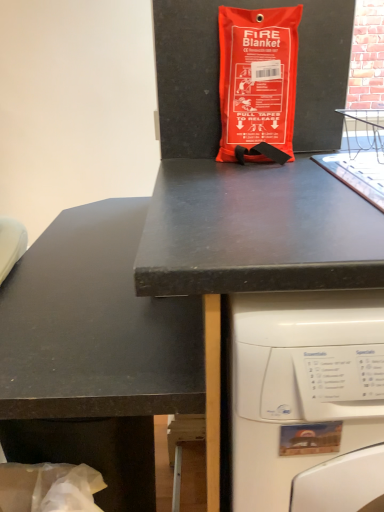
Question: Is black matte counter top at center oriented away from black matte desk at upper center?

Choices:
 (A) no
 (B) yes

Answer: (B)

Question: Is black matte counter top at center located outside black matte desk at upper center?

Choices:
 (A) no
 (B) yes

Answer: (B)

Question: From the image's perspective, is black matte counter top at center above black matte desk at upper center?

Choices:
 (A) no
 (B) yes

Answer: (A)

Question: Can you confirm if black matte counter top at center is wider than black matte desk at upper center?

Choices:
 (A) no
 (B) yes

Answer: (A)

Question: Is black matte counter top at center aimed at black matte desk at upper center?

Choices:
 (A) yes
 (B) no

Answer: (B)

Question: From the image's perspective, is black matte desk at upper center positioned above or below black matte counter top at center?

Choices:
 (A) below
 (B) above

Answer: (B)

Question: Considering the relative positions of black matte desk at upper center and black matte counter top at center in the image provided, is black matte desk at upper center to the left or to the right of black matte counter top at center?

Choices:
 (A) right
 (B) left

Answer: (A)

Question: Choose the correct answer: Is black matte desk at upper center inside black matte counter top at center or outside it?

Choices:
 (A) outside
 (B) inside

Answer: (A)

Question: From their relative heights in the image, would you say black matte desk at upper center is taller or shorter than black matte counter top at center?

Choices:
 (A) tall
 (B) short

Answer: (A)

Question: Considering the positions of point (228, 155) and point (84, 211), is point (228, 155) closer or farther from the camera than point (84, 211)?

Choices:
 (A) closer
 (B) farther

Answer: (A)

Question: In terms of width, does orange fabric fire blanket at center look wider or thinner when compared to black matte counter top at center?

Choices:
 (A) wide
 (B) thin

Answer: (B)

Question: Is orange fabric fire blanket at center bigger or smaller than black matte counter top at center?

Choices:
 (A) small
 (B) big

Answer: (A)

Question: Is orange fabric fire blanket at center in front of or behind black matte counter top at center in the image?

Choices:
 (A) front
 (B) behind

Answer: (B)

Question: In terms of height, does orange fabric fire blanket at center look taller or shorter compared to black matte desk at upper center?

Choices:
 (A) tall
 (B) short

Answer: (B)

Question: Is orange fabric fire blanket at center bigger or smaller than black matte desk at upper center?

Choices:
 (A) small
 (B) big

Answer: (A)